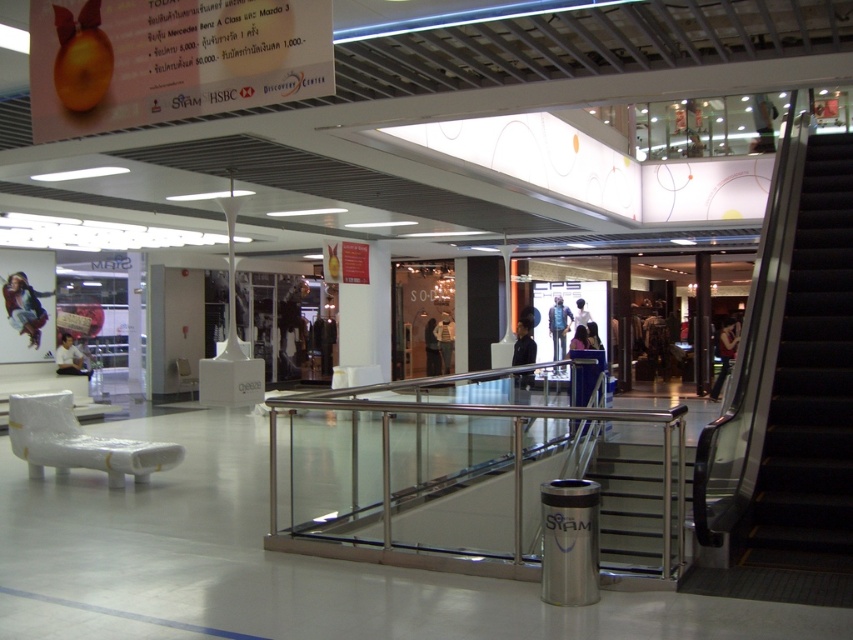
You are a shopper who wants to sit down and try on a new jacket. You see a matte black jacket at left and black rubber stairs at right. Which object should you approach first if you want to sit before trying on the jacket?

You should approach the matte black jacket at left first because it is closer to the white bench covered with plastic wrap, which is where you can sit.

From the picture: You are standing at the camera position in the mall and want to walk to both points. Which point, point (767, 524) or point (22, 292), will you reach first?

You will reach point (767, 524) first because it is closer to the camera than point (22, 292).

You are a customer in the mall looking at the denim jacket at center and the white shirt at left. Which clothing item is located to the right of the other?

The denim jacket at center is positioned on the right side of white shirt at left.